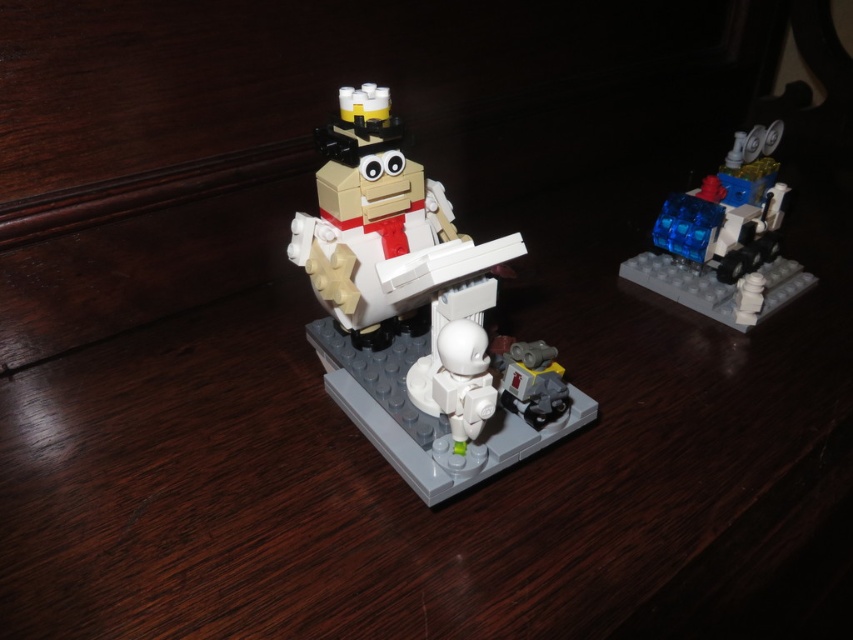
Is matte plastic astronaut at center above transparent blue plastic at upper right?

No, matte plastic astronaut at center is not above transparent blue plastic at upper right.

Is matte plastic astronaut at center thinner than transparent blue plastic at upper right?

Incorrect, matte plastic astronaut at center's width is not less than transparent blue plastic at upper right's.

What do you see at coordinates (415, 314) in the screenshot? The image size is (853, 640). I see `matte plastic astronaut at center` at bounding box center [415, 314].

Where is `matte plastic astronaut at center`? matte plastic astronaut at center is located at coordinates [x=415, y=314].